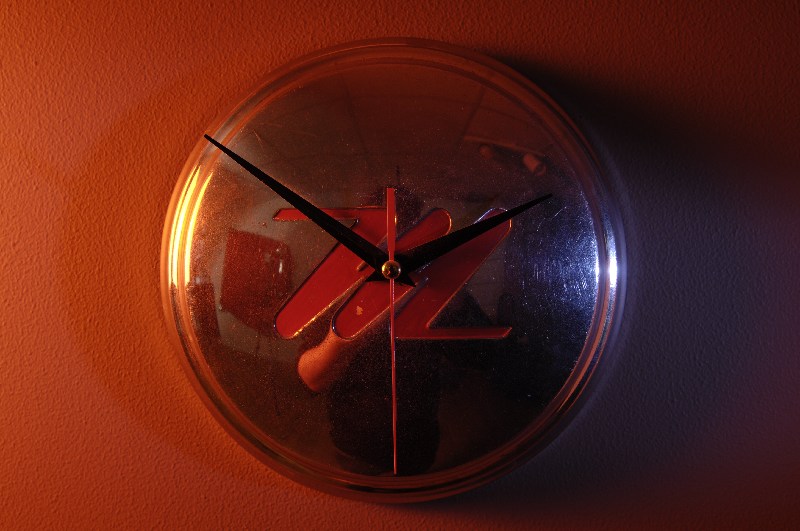
Find the location of a particular element. clock is located at coordinates (444, 304).